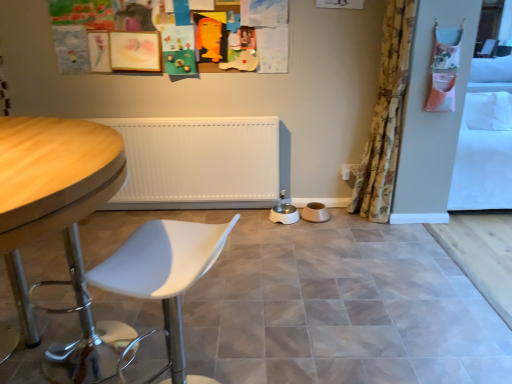
Question: Based on their sizes in the image, would you say floral fabric curtain at right is bigger or smaller than wooden table at left?

Choices:
 (A) small
 (B) big

Answer: (A)

Question: From a real-world perspective, is floral fabric curtain at right positioned above or below wooden table at left?

Choices:
 (A) below
 (B) above

Answer: (B)

Question: Considering the real-world distances, which object is farthest from the wooden table at left?

Choices:
 (A) floral fabric curtain at right
 (B) white plastic swivel chair at lower left
 (C) white fabric screen door at right
 (D) matte ceramic tile at center

Answer: (C)

Question: Considering the real-world distances, which object is farthest from the white plastic swivel chair at lower left?

Choices:
 (A) wooden table at left
 (B) white fabric screen door at right
 (C) matte ceramic tile at center
 (D) floral fabric curtain at right

Answer: (B)